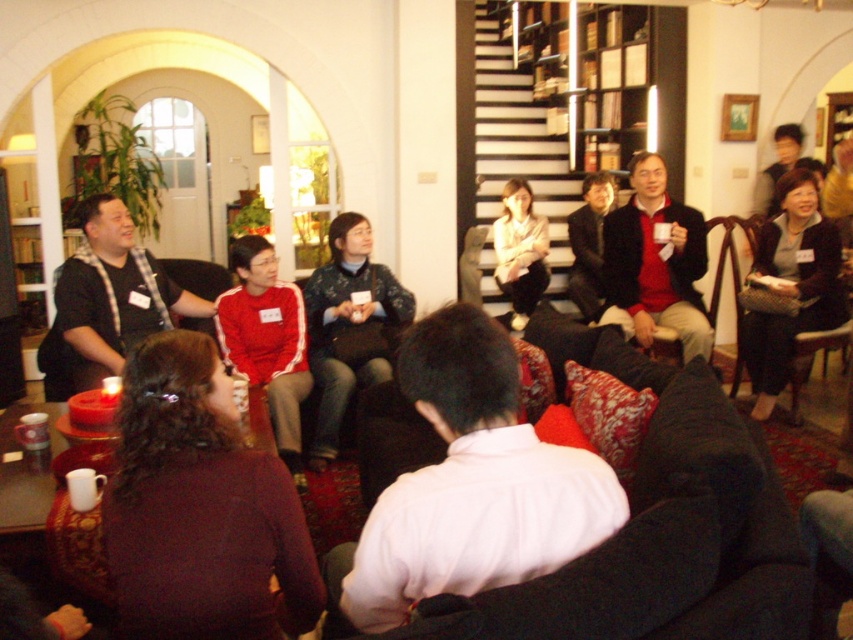
Is dark gray sweater at center bigger than red fabric jacket at center?

Yes.

What do you see at coordinates (791, 284) in the screenshot? I see `dark gray sweater at center` at bounding box center [791, 284].

Where is `dark gray sweater at center`? The height and width of the screenshot is (640, 853). dark gray sweater at center is located at coordinates (791, 284).

Is matte black shirt at left to the left of dark gray sweater at center from the viewer's perspective?

Indeed, matte black shirt at left is positioned on the left side of dark gray sweater at center.

Can you confirm if matte black shirt at left is smaller than dark gray sweater at center?

Actually, matte black shirt at left might be larger than dark gray sweater at center.

Who is more distant from viewer, (172,294) or (827,243)?

The point (827,243) is behind.

Locate an element on the screen. The height and width of the screenshot is (640, 853). matte black shirt at left is located at coordinates (111, 296).

Is matte black shirt at left below dark blue textured sweater at center?

Incorrect, matte black shirt at left is not positioned below dark blue textured sweater at center.

Does matte black shirt at left lie in front of dark blue textured sweater at center?

That is True.

Where is `matte black shirt at left`? matte black shirt at left is located at coordinates (111, 296).